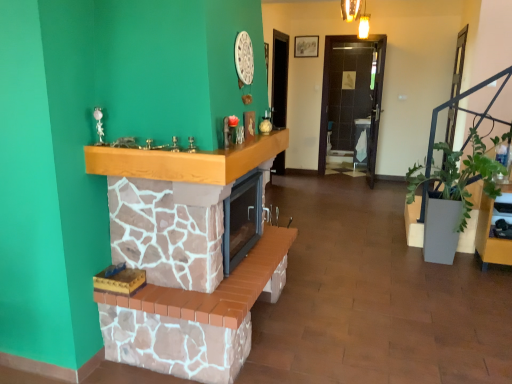
Question: Should I look upward or downward to see stone fireplace at center?

Choices:
 (A) up
 (B) down

Answer: (B)